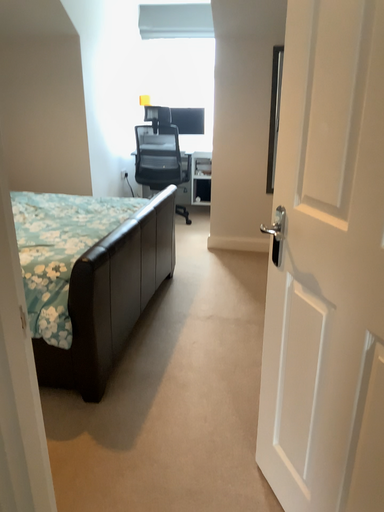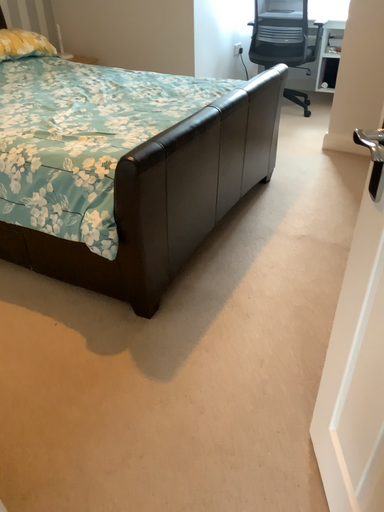
Question: Which way did the camera rotate in the video?

Choices:
 (A) rotated upward
 (B) rotated downward

Answer: (B)